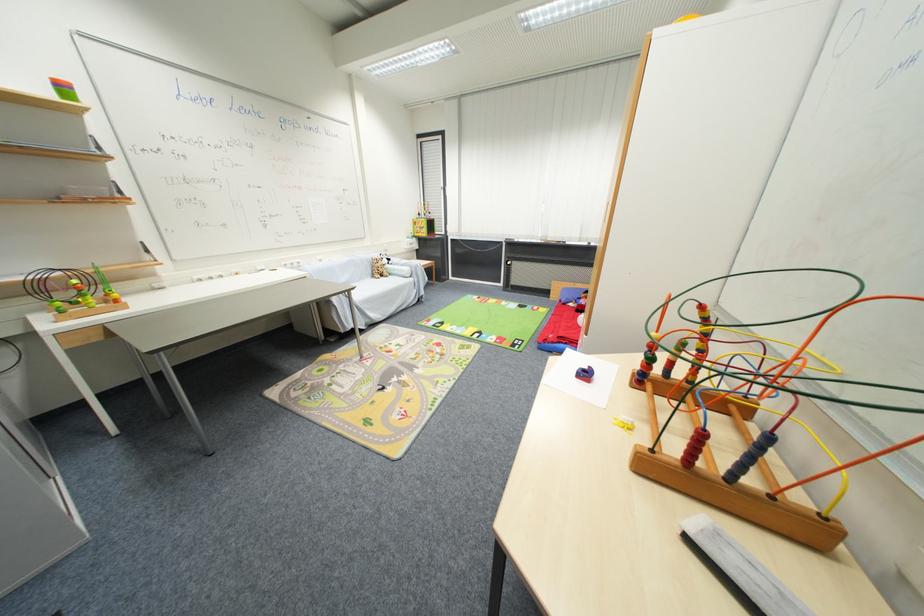
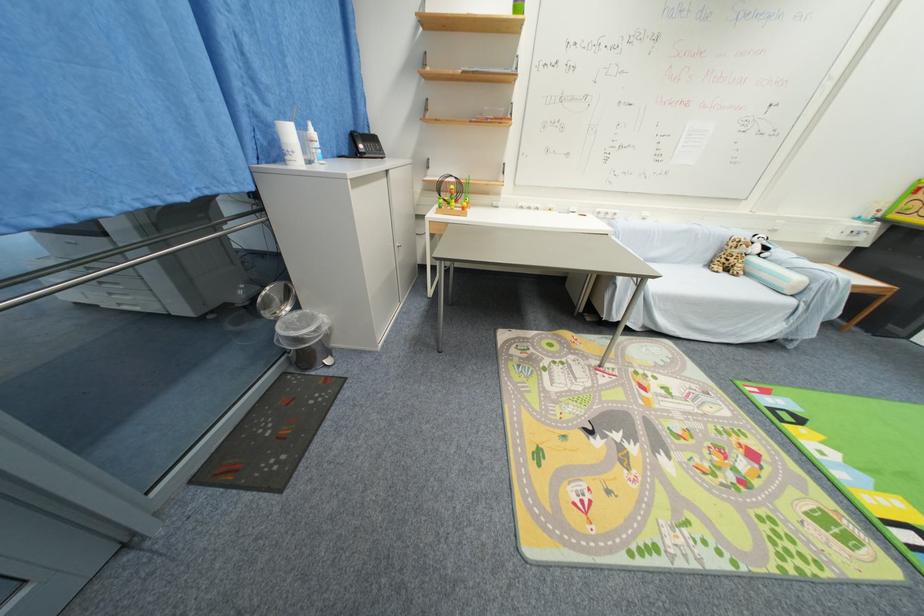
In the second image, find the point that corresponds to point 379,277 in the first image.

(714, 265)